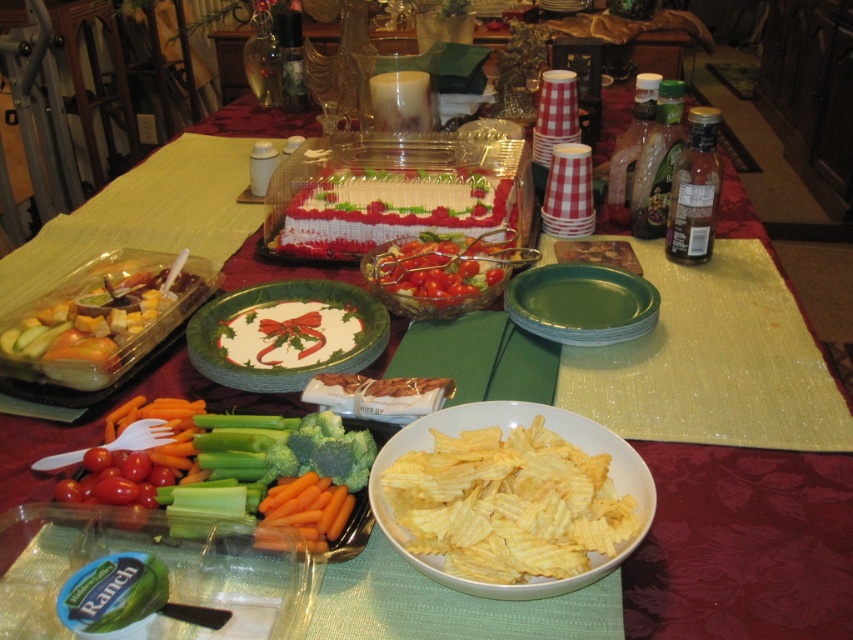
You are a guest at the table and want to place your napkin on the object that is taller between the green crisp celery at center and the white paper plate at center. Which object should you choose?

The white paper plate at center is taller than the green crisp celery at center, so you should place your napkin on the white paper plate at center.

You are looking at a festive table setting with a red tablecloth. There is a point marked at coordinates (x=294, y=474). Based on the scene description, what object is located at that point?

The point at coordinates (x=294, y=474) is on green crisp celery at center.